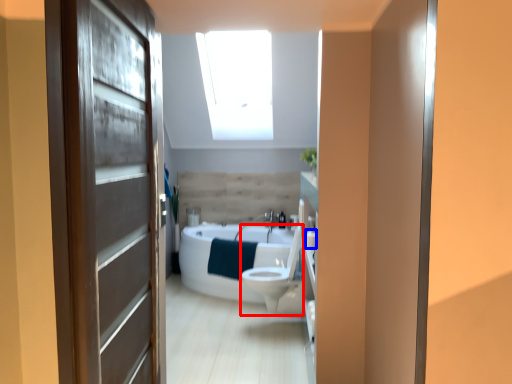
Question: Which point is closer to the camera, toilet bowl (highlighted by a red box) or toilet paper (highlighted by a blue box)?

Choices:
 (A) toilet bowl
 (B) toilet paper

Answer: (B)